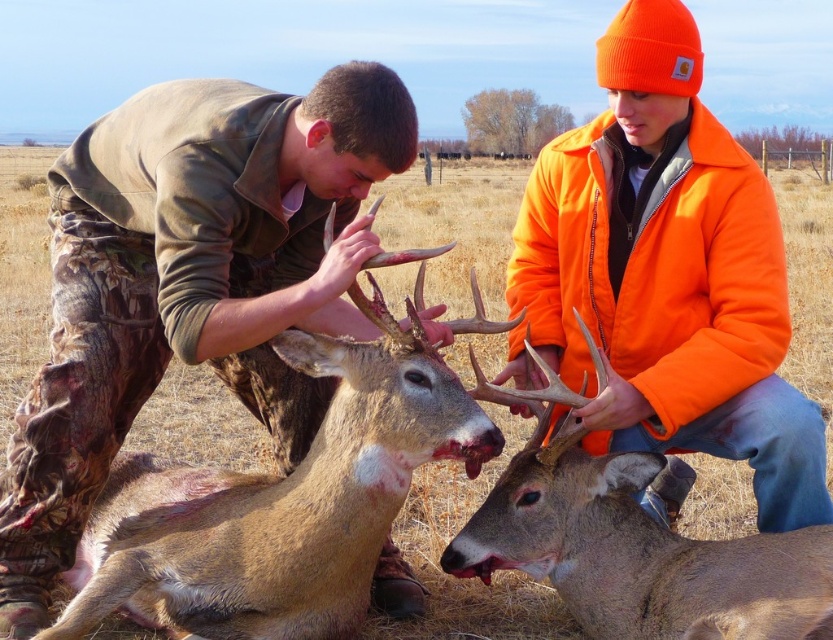
Is the position of orange fleece jacket at upper right more distant than that of brown fur deer at center?

Yes, it is behind brown fur deer at center.

Find the location of a particular element. This screenshot has height=640, width=833. orange fleece jacket at upper right is located at coordinates (667, 273).

Locate an element on the screen. This screenshot has height=640, width=833. orange fleece jacket at upper right is located at coordinates (667, 273).

Which is more to the right, brown fur deer at center or brown velvet deer at center?

From the viewer's perspective, brown velvet deer at center appears more on the right side.

Can you confirm if brown fur deer at center is smaller than brown velvet deer at center?

No.

Is point (210, 502) closer to viewer compared to point (469, 573)?

Yes.

Find the location of a particular element. This screenshot has width=833, height=640. brown fur deer at center is located at coordinates (280, 502).

Does point (719, 448) come farther from viewer compared to point (731, 593)?

Yes, point (719, 448) is behind point (731, 593).

Is orange fleece jacket at upper right taller than brown velvet deer at center?

Yes, orange fleece jacket at upper right is taller than brown velvet deer at center.

Between point (610, 298) and point (729, 621), which one is positioned behind?

Positioned behind is point (610, 298).

The image size is (833, 640). In order to click on orange fleece jacket at upper right in this screenshot , I will do pyautogui.click(x=667, y=273).